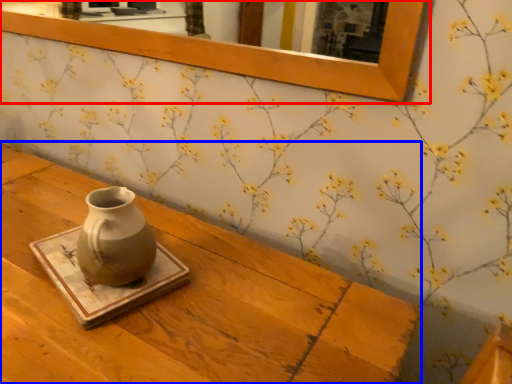
Question: Which object is further to the camera taking this photo, picture frame (highlighted by a red box) or table (highlighted by a blue box)?

Choices:
 (A) picture frame
 (B) table

Answer: (A)